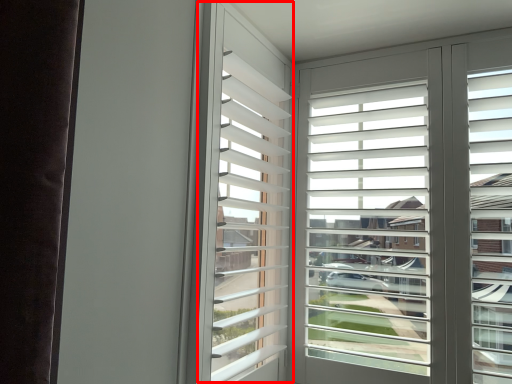
Question: From the image's perspective, where is bay window (annotated by the red box) located in relation to window screen in the image?

Choices:
 (A) above
 (B) below

Answer: (A)